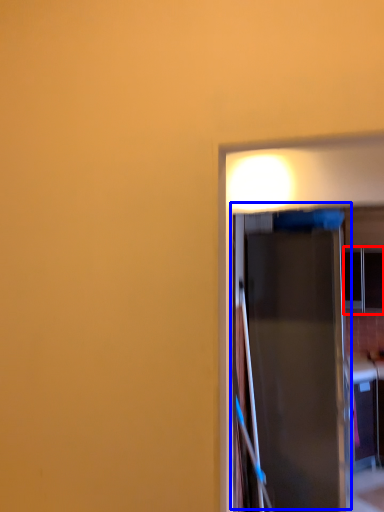
Question: Which object is closer to the camera taking this photo, window (highlighted by a red box) or door (highlighted by a blue box)?

Choices:
 (A) window
 (B) door

Answer: (B)